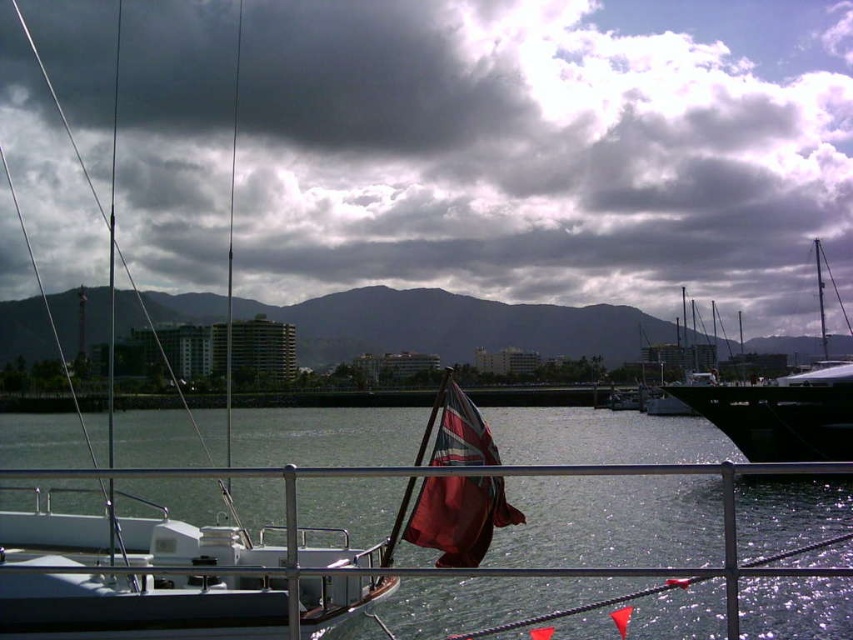
You are a sailor on the boat and want to determine the relative heights of the clear water at center and the white matte boat at left. Based on the scene, which one is taller?

The clear water at center is shorter than the white matte boat at left, so the white matte boat at left is taller.

You are standing on the deck of a boat and notice a point marked at coordinates (167, 579). Based on the scene described, what object does this point correspond to?

The point at coordinates (167, 579) corresponds to the white matte boat at left as indicated in the Objects Description.